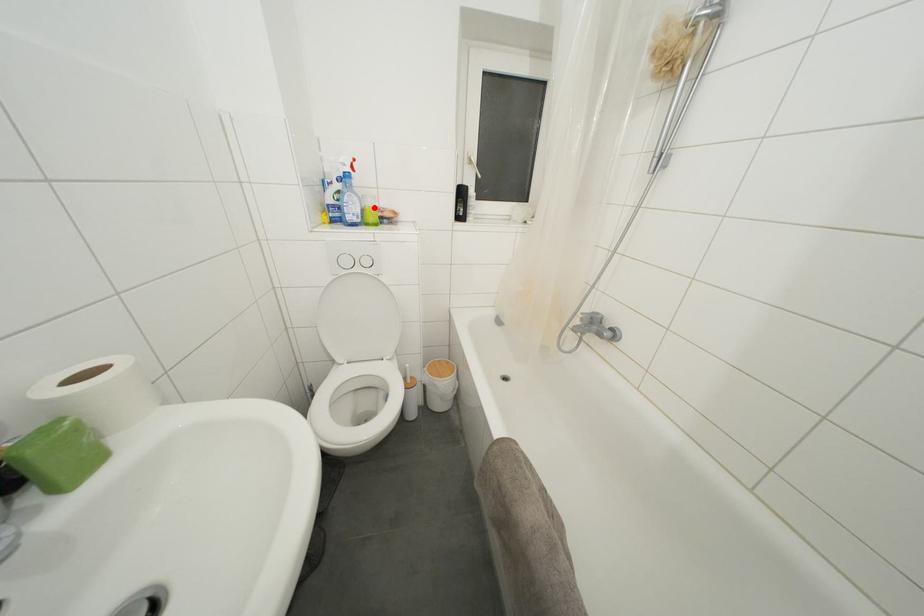
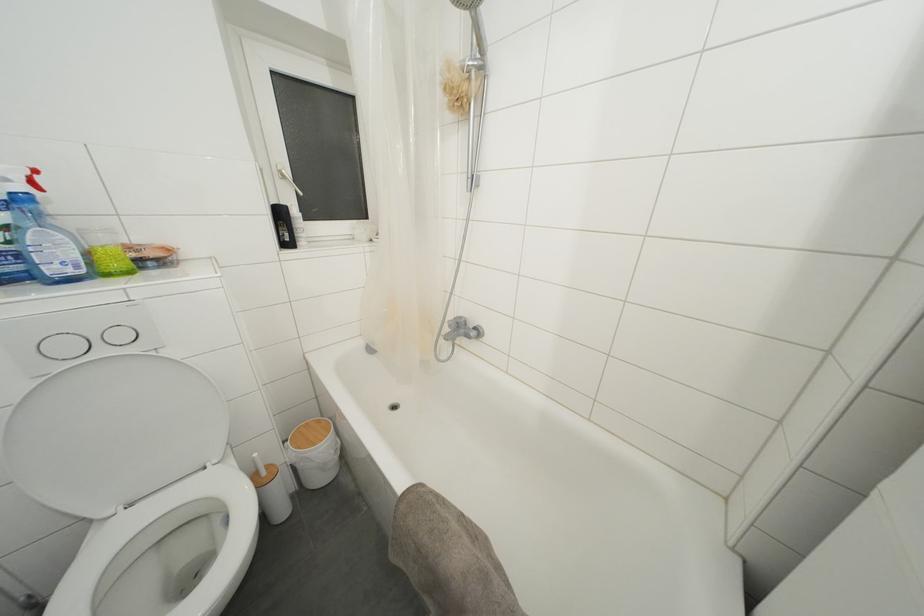
Question: I am providing you with two images of the same scene from different viewpoints. Image1 has a red point marked. In image2, the corresponding 3D location appears at what relative position? Reply with the corresponding letter.

Choices:
 (A) Closer
 (B) Farther

Answer: (B)